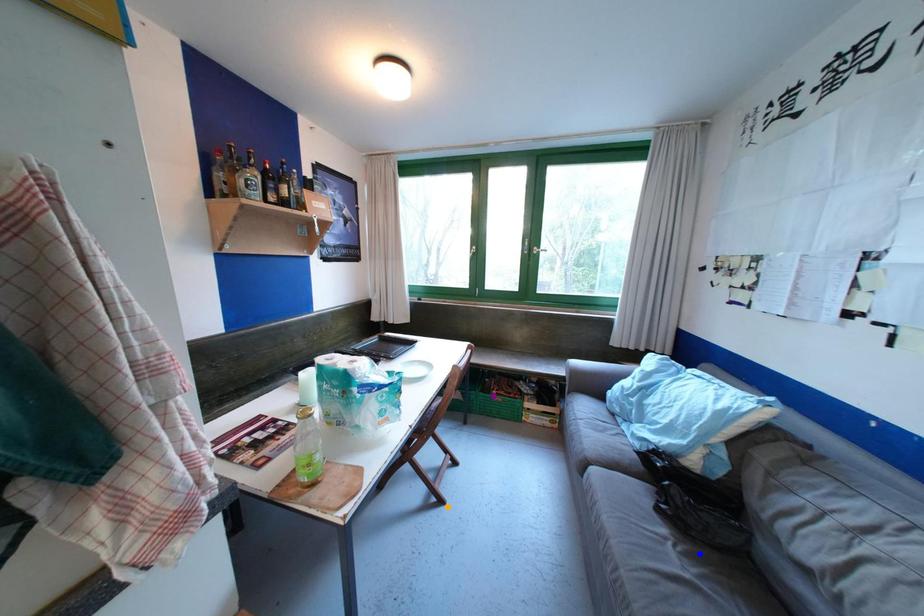
Order these from nearest to farthest:
1. orange point
2. purple point
3. blue point

blue point → orange point → purple point